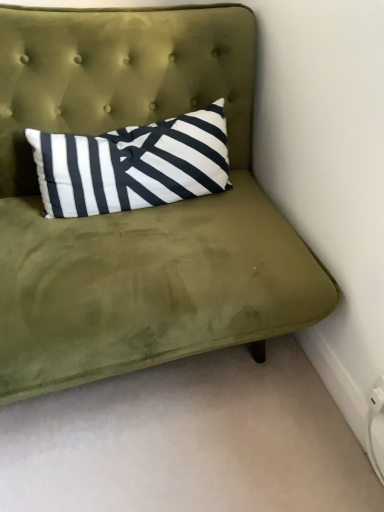
Question: Is velvet green headboard at upper center bigger than olive green velvet couch at upper center?

Choices:
 (A) yes
 (B) no

Answer: (B)

Question: Is velvet green headboard at upper center taller than olive green velvet couch at upper center?

Choices:
 (A) no
 (B) yes

Answer: (A)

Question: Is velvet green headboard at upper center oriented towards olive green velvet couch at upper center?

Choices:
 (A) yes
 (B) no

Answer: (A)

Question: Considering the relative positions of velvet green headboard at upper center and olive green velvet couch at upper center in the image provided, is velvet green headboard at upper center to the left of olive green velvet couch at upper center from the viewer's perspective?

Choices:
 (A) no
 (B) yes

Answer: (A)

Question: Is velvet green headboard at upper center further to the viewer compared to olive green velvet couch at upper center?

Choices:
 (A) yes
 (B) no

Answer: (A)

Question: Is velvet green headboard at upper center inside or outside of olive green velvet couch at upper center?

Choices:
 (A) outside
 (B) inside

Answer: (B)

Question: From the image's perspective, is velvet green headboard at upper center located above or below olive green velvet couch at upper center?

Choices:
 (A) below
 (B) above

Answer: (B)

Question: Is velvet green headboard at upper center to the left or to the right of olive green velvet couch at upper center in the image?

Choices:
 (A) left
 (B) right

Answer: (B)

Question: In the image, is velvet green headboard at upper center positioned in front of or behind olive green velvet couch at upper center?

Choices:
 (A) behind
 (B) front

Answer: (A)

Question: Is olive green velvet couch at upper center wider or thinner than velvet green headboard at upper center?

Choices:
 (A) wide
 (B) thin

Answer: (A)

Question: From a real-world perspective, relative to velvet green headboard at upper center, is olive green velvet couch at upper center vertically above or below?

Choices:
 (A) below
 (B) above

Answer: (A)

Question: Considering the relative positions of olive green velvet couch at upper center and velvet green headboard at upper center in the image provided, is olive green velvet couch at upper center to the left or to the right of velvet green headboard at upper center?

Choices:
 (A) right
 (B) left

Answer: (B)

Question: Is olive green velvet couch at upper center in front of or behind velvet green headboard at upper center in the image?

Choices:
 (A) front
 (B) behind

Answer: (A)

Question: In terms of width, does velvet green headboard at upper center look wider or thinner when compared to white plastic electric outlet at lower right?

Choices:
 (A) wide
 (B) thin

Answer: (A)

Question: In terms of size, does velvet green headboard at upper center appear bigger or smaller than white plastic electric outlet at lower right?

Choices:
 (A) big
 (B) small

Answer: (A)